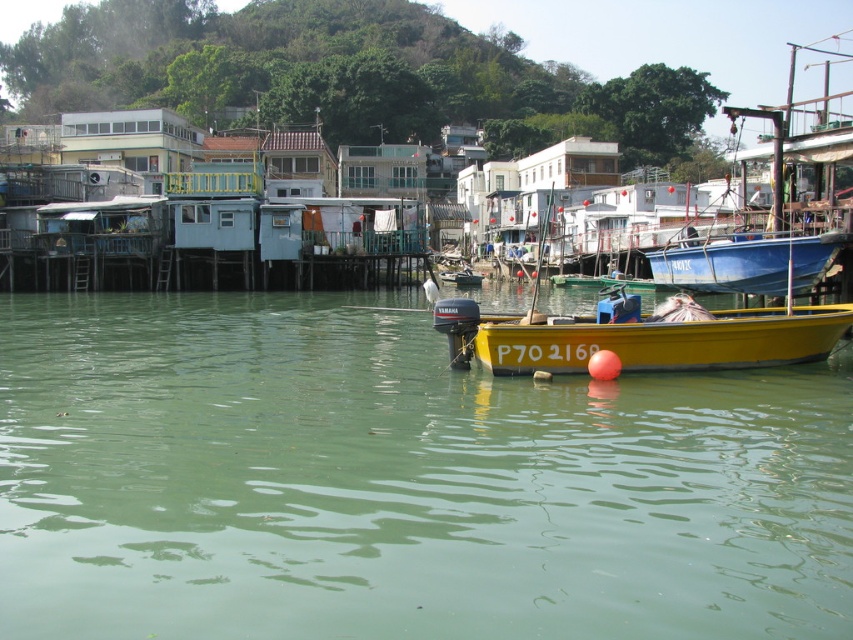
Does green water at center appear under yellow matte boat at center?

Correct, green water at center is located below yellow matte boat at center.

Is point (0, 474) less distant than point (473, 300)?

Yes, it is.

Is point (328, 474) positioned behind point (509, 364)?

No, it is not.

You are a GUI agent. You are given a task and a screenshot of the screen. Output one action in this format:
    pyautogui.click(x=<x>, y=<y>)
    Task: Click on the green water at center
    Image resolution: width=853 pixels, height=640 pixels.
    Given the screenshot: What is the action you would take?
    pyautogui.click(x=397, y=483)

Which is below, green water at center or blue matte boat at right?

green water at center is below.

Measure the distance between green water at center and camera.

9.88 meters

Which is behind, point (296, 339) or point (805, 273)?

The point (296, 339) is behind.

This screenshot has height=640, width=853. I want to click on green water at center, so click(x=397, y=483).

Which is behind, point (834, 109) or point (849, 308)?

The point (834, 109) is behind.

Identify the location of blue matte boat at right. (782, 198).

Which is in front, point (822, 77) or point (494, 333)?

Point (494, 333)

This screenshot has height=640, width=853. What are the coordinates of `blue matte boat at right` in the screenshot? It's located at (782, 198).